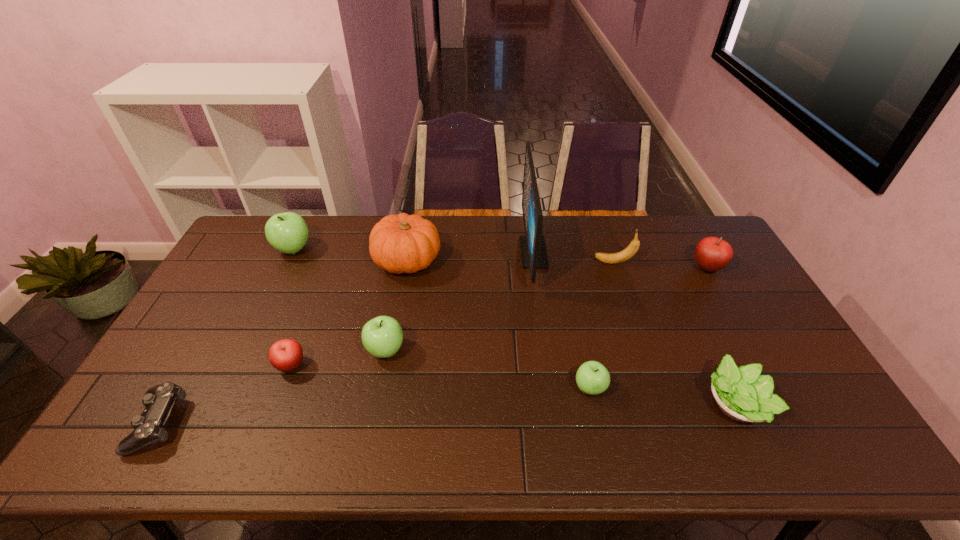
Find the location of a particular element. The width and height of the screenshot is (960, 540). blank space located on the back of the control is located at coordinates (231, 295).

You are a GUI agent. You are given a task and a screenshot of the screen. Output one action in this format:
    pyautogui.click(x=<x>, y=<y>)
    Task: Click on the computer monitor that is at the far edge
    The width and height of the screenshot is (960, 540).
    Given the screenshot: What is the action you would take?
    pyautogui.click(x=533, y=251)

Where is `pumpkin at the far edge`? The width and height of the screenshot is (960, 540). pumpkin at the far edge is located at coordinates (402, 243).

Identify the location of apple that is at the far edge. (287, 232).

Identify the location of lettuce positioned at the near edge. The image size is (960, 540). (742, 394).

Locate an element on the screen. The height and width of the screenshot is (540, 960). control positioned at the near edge is located at coordinates (148, 427).

The width and height of the screenshot is (960, 540). What are the coordinates of `apple that is at the left edge` in the screenshot? It's located at (287, 232).

This screenshot has height=540, width=960. Identify the location of control that is at the left edge. (148, 427).

Where is `apple present at the right edge`? apple present at the right edge is located at coordinates (712, 254).

You are a GUI agent. You are given a task and a screenshot of the screen. Output one action in this format:
    pyautogui.click(x=<x>, y=<y>)
    Task: Click on the lettuce that is positioned at the right edge
    The width and height of the screenshot is (960, 540).
    Given the screenshot: What is the action you would take?
    pyautogui.click(x=742, y=394)